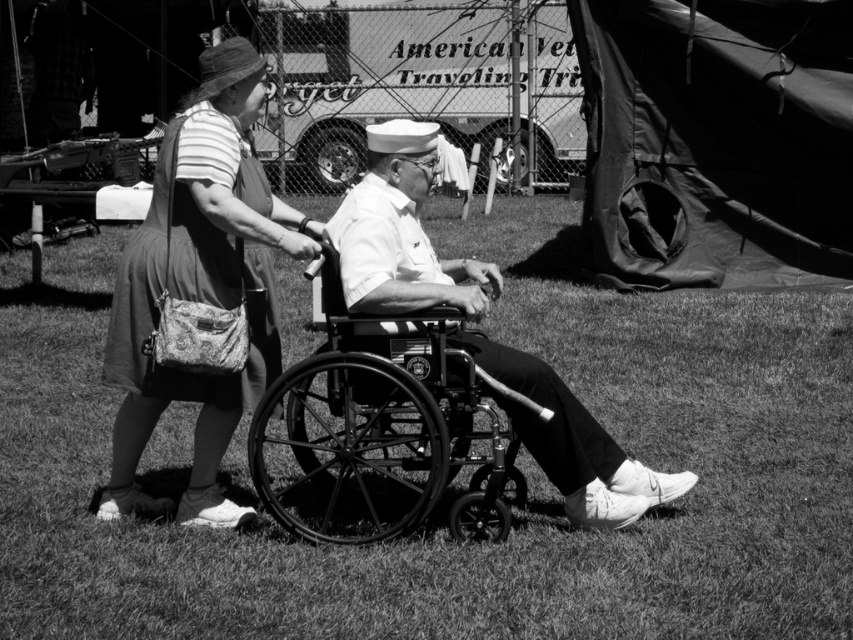
Can you confirm if grass at center is positioned above matte fabric dress at center?

Actually, grass at center is below matte fabric dress at center.

Which is more to the left, grass at center or matte fabric dress at center?

From the viewer's perspective, matte fabric dress at center appears more on the left side.

The width and height of the screenshot is (853, 640). In order to click on grass at center in this screenshot , I will do `click(460, 490)`.

Which is in front, point (660, 342) or point (280, 515)?

Point (280, 515) is in front.

Which is behind, point (706, 497) or point (334, 504)?

The point (706, 497) is more distant.

I want to click on grass at center, so click(460, 490).

Does matte fabric dress at center have a greater width compared to black metal wheelchair at center?

Incorrect, matte fabric dress at center's width does not surpass black metal wheelchair at center's.

Is matte fabric dress at center behind black metal wheelchair at center?

Yes.

Is point (166, 138) closer to camera compared to point (334, 328)?

No.

Find the location of a particular element. This screenshot has height=640, width=853. matte fabric dress at center is located at coordinates (200, 284).